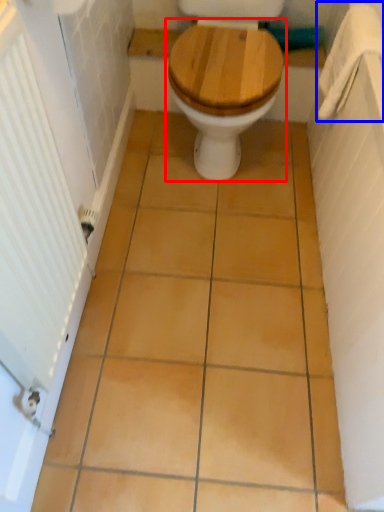
Question: Which object is closer to the camera taking this photo, toilet (highlighted by a red box) or towel bar (highlighted by a blue box)?

Choices:
 (A) toilet
 (B) towel bar

Answer: (A)